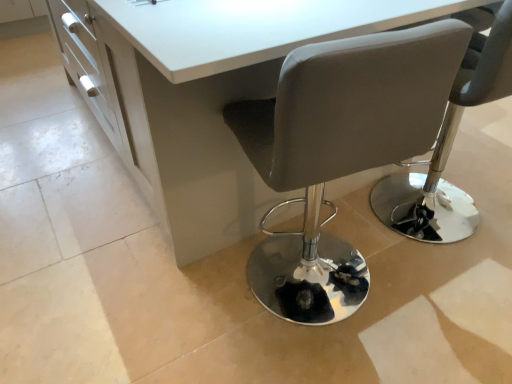
Image resolution: width=512 pixels, height=384 pixels. What do you see at coordinates (202, 93) in the screenshot?
I see `white glossy table at center` at bounding box center [202, 93].

I want to click on matte gray chair at center, the second chair in the left-to-right sequence, so [x=449, y=147].

The image size is (512, 384). Find the location of `white glossy table at center`. white glossy table at center is located at coordinates (202, 93).

Is matte gray chair at center, the first chair from the right, oriented away from matte gray chair at center, which is the 2th chair in right-to-left order?

That's not correct — matte gray chair at center, the first chair from the right, is not looking away from matte gray chair at center, which is the 2th chair in right-to-left order.

From the picture: Can you confirm if matte gray chair at center, the first chair from the right, is wider than matte gray chair at center, marked as the first chair in a left-to-right arrangement?

Yes.

From the image's perspective, between matte gray chair at center, the first chair from the right, and matte gray chair at center, marked as the first chair in a left-to-right arrangement, who is located below?

From the image's view, matte gray chair at center, marked as the first chair in a left-to-right arrangement, is below.

Which of these two, matte gray chair at center, the first chair from the right, or matte gray chair at center, which is the 2th chair in right-to-left order, is bigger?

With larger size is matte gray chair at center, the first chair from the right.

From the image's perspective, is white glossy table at center above or below matte gray chair at center, the first chair from the right?

Clearly, from the image's perspective, white glossy table at center is above matte gray chair at center, the first chair from the right.

Between white glossy table at center and matte gray chair at center, the second chair in the left-to-right sequence, which one has larger size?

With larger size is white glossy table at center.

Locate an element on the screen. The width and height of the screenshot is (512, 384). table lying in front of the matte gray chair at center, the second chair in the left-to-right sequence is located at coordinates (202, 93).

Is the position of white glossy table at center less distant than that of matte gray chair at center, the first chair from the right?

Yes, it is.

From the image's perspective, is matte gray chair at center, marked as the first chair in a left-to-right arrangement, positioned above or below matte gray chair at center, the first chair from the right?

matte gray chair at center, marked as the first chair in a left-to-right arrangement, is situated lower than matte gray chair at center, the first chair from the right, in the image.

Is matte gray chair at center, marked as the first chair in a left-to-right arrangement, behind matte gray chair at center, the second chair in the left-to-right sequence?

No, it is not.

From a real-world perspective, is matte gray chair at center, which is the 2th chair in right-to-left order, positioned over matte gray chair at center, the second chair in the left-to-right sequence, based on gravity?

Correct, in the physical world, matte gray chair at center, which is the 2th chair in right-to-left order, is higher than matte gray chair at center, the second chair in the left-to-right sequence.

Is point (361, 101) farther from viewer compared to point (424, 231)?

No, (361, 101) is closer to viewer.

Considering the sizes of objects white glossy table at center and matte gray chair at center, which is the 2th chair in right-to-left order, in the image provided, who is bigger, white glossy table at center or matte gray chair at center, which is the 2th chair in right-to-left order,?

Bigger between the two is white glossy table at center.

Does white glossy table at center have a greater height compared to matte gray chair at center, which is the 2th chair in right-to-left order?

Incorrect, the height of white glossy table at center is not larger of that of matte gray chair at center, which is the 2th chair in right-to-left order.

Is white glossy table at center next to matte gray chair at center, marked as the first chair in a left-to-right arrangement, and touching it?

Answer: No.

From a real-world perspective, is white glossy table at center physically located above or below matte gray chair at center, which is the 2th chair in right-to-left order?

From a real-world perspective, white glossy table at center is physically below matte gray chair at center, which is the 2th chair in right-to-left order.

Are matte gray chair at center, the second chair in the left-to-right sequence, and white glossy table at center far apart?

They are positioned close to each other.

Which object is further away from the camera taking this photo, matte gray chair at center, the second chair in the left-to-right sequence, or white glossy table at center?

matte gray chair at center, the second chair in the left-to-right sequence, is further from the camera.

Is matte gray chair at center, the first chair from the right, to the right of white glossy table at center from the viewer's perspective?

Indeed, matte gray chair at center, the first chair from the right, is positioned on the right side of white glossy table at center.

The height and width of the screenshot is (384, 512). Find the location of `table in front of the matte gray chair at center, the first chair from the right`. table in front of the matte gray chair at center, the first chair from the right is located at coordinates (202, 93).

Is matte gray chair at center, which is the 2th chair in right-to-left order, completely or partially outside of white glossy table at center?

No, matte gray chair at center, which is the 2th chair in right-to-left order, is not outside of white glossy table at center.

Find the location of a particular element. This screenshot has width=512, height=384. the 2nd chair below the white glossy table at center (from the image's perspective) is located at coordinates (339, 151).

Which of these two, matte gray chair at center, which is the 2th chair in right-to-left order, or white glossy table at center, is wider?

white glossy table at center is wider.

At what (x,y) coordinates should I click in order to perform the action: click on chair in front of the matte gray chair at center, the second chair in the left-to-right sequence. Please return your answer as a coordinate pair (x, y). Looking at the image, I should click on (339, 151).

Identify the location of table to the left of matte gray chair at center, the first chair from the right. (202, 93).

From the image, which object appears to be nearer to matte gray chair at center, which is the 2th chair in right-to-left order, white glossy table at center or matte gray chair at center, the second chair in the left-to-right sequence?

Based on the image, white glossy table at center appears to be nearer to matte gray chair at center, which is the 2th chair in right-to-left order.

Considering their positions, is matte gray chair at center, marked as the first chair in a left-to-right arrangement, positioned further to white glossy table at center than matte gray chair at center, the second chair in the left-to-right sequence?

The object further to white glossy table at center is matte gray chair at center, the second chair in the left-to-right sequence.

Looking at this image, from the image, which object appears to be farther from matte gray chair at center, the second chair in the left-to-right sequence, white glossy table at center or matte gray chair at center, marked as the first chair in a left-to-right arrangement?

Based on the image, matte gray chair at center, marked as the first chair in a left-to-right arrangement, appears to be further to matte gray chair at center, the second chair in the left-to-right sequence.

When comparing their distances from matte gray chair at center, the first chair from the right, does matte gray chair at center, which is the 2th chair in right-to-left order, or white glossy table at center seem closer?

white glossy table at center lies closer to matte gray chair at center, the first chair from the right, than the other object.

Based on their spatial positions, is matte gray chair at center, the first chair from the right, or white glossy table at center further from matte gray chair at center, which is the 2th chair in right-to-left order?

Based on the image, matte gray chair at center, the first chair from the right, appears to be further to matte gray chair at center, which is the 2th chair in right-to-left order.

From the image, which object appears to be farther from white glossy table at center, matte gray chair at center, the second chair in the left-to-right sequence, or matte gray chair at center, which is the 2th chair in right-to-left order?

Among the two, matte gray chair at center, the second chair in the left-to-right sequence, is located further to white glossy table at center.

What are the coordinates of `chair located between white glossy table at center and matte gray chair at center, the first chair from the right, in the left-right direction` in the screenshot? It's located at (339, 151).